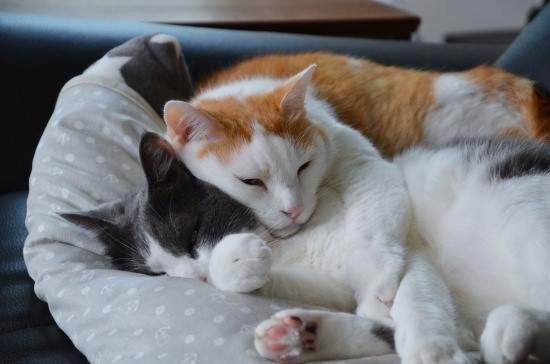
This screenshot has width=550, height=364. I want to click on pillow, so coord(102,317).